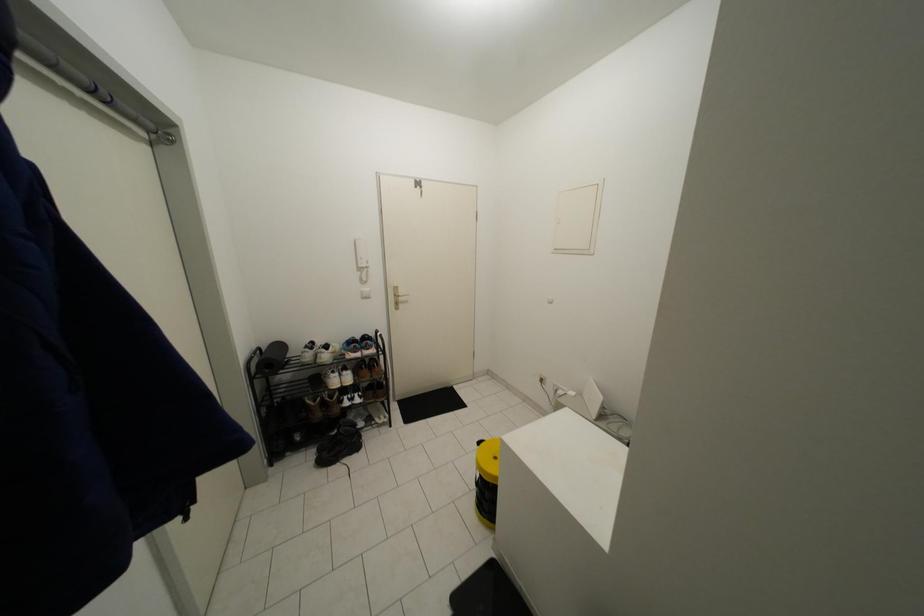
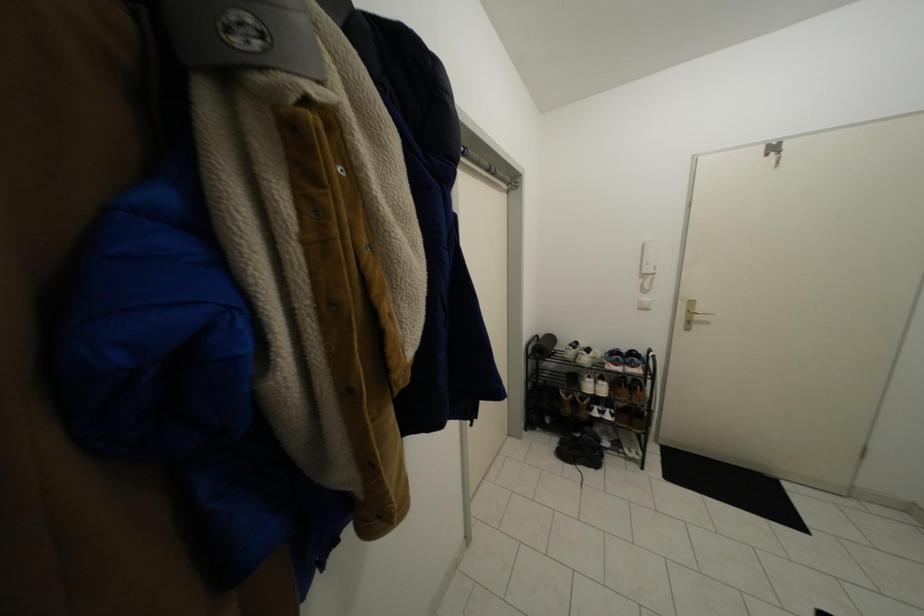
Question: Based on the continuous images, in which direction is the camera rotating? Reply with the corresponding letter.

Choices:
 (A) Left
 (B) Right
 (C) Up
 (D) Down

Answer: (A)